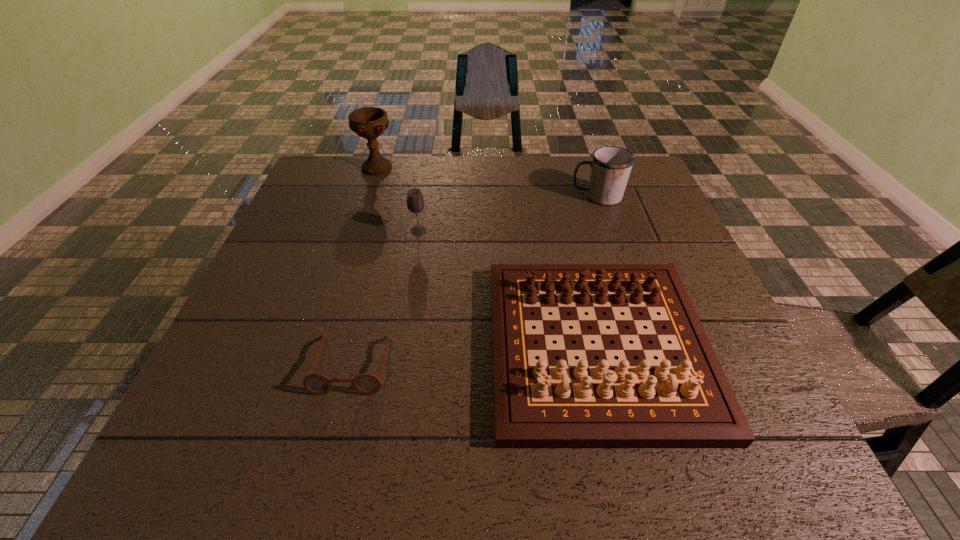
In order to click on vacant area located 0.350m on the front of the glass drink container in this screenshot , I will do `click(400, 342)`.

Image resolution: width=960 pixels, height=540 pixels. What are the coordinates of `vacant space located on the front-facing side of the shortest object` in the screenshot? It's located at (327, 466).

I want to click on chalice that is at the far edge, so tap(368, 122).

This screenshot has width=960, height=540. I want to click on mug present at the far edge, so click(610, 167).

Locate an element on the screen. object that is at the near edge is located at coordinates (686, 403).

This screenshot has width=960, height=540. I want to click on object positioned at the left edge, so click(368, 122).

In order to click on mug that is at the right edge in this screenshot , I will do `click(610, 167)`.

Where is `gameboard that is at the right edge`? The image size is (960, 540). gameboard that is at the right edge is located at coordinates (686, 403).

You are a GUI agent. You are given a task and a screenshot of the screen. Output one action in this format:
    pyautogui.click(x=<x>, y=<y>)
    Task: Click on the object located at the far left corner
    
    Given the screenshot: What is the action you would take?
    pyautogui.click(x=368, y=122)

Where is `object that is at the far right corner`? The image size is (960, 540). object that is at the far right corner is located at coordinates (610, 167).